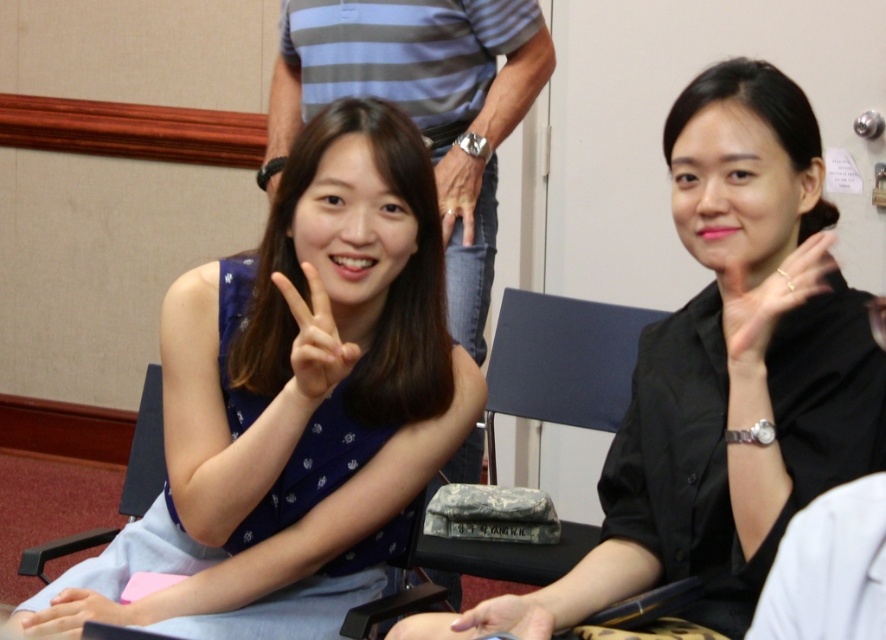
Question: Which object appears farthest from the camera in this image?

Choices:
 (A) camouflage fabric bag at center
 (B) blue fabric chair at left
 (C) blue dotted dress at left

Answer: (A)

Question: Is gold metallic ring at right smaller than matte black hand at center?

Choices:
 (A) no
 (B) yes

Answer: (A)

Question: Is the position of black satin blouse at center more distant than that of matte pink hand at lower left?

Choices:
 (A) no
 (B) yes

Answer: (B)

Question: Which object is closer to the camera taking this photo?

Choices:
 (A) gold metallic ring at right
 (B) black satin blouse at center
 (C) camouflage fabric bag at center
 (D) blue fabric chair at left

Answer: (B)

Question: Can you confirm if camouflage fabric bag at center is positioned above matte black hand at center?

Choices:
 (A) yes
 (B) no

Answer: (A)

Question: Which point is farther to the camera?

Choices:
 (A) gold metallic ring at right
 (B) black satin blouse at center
 (C) matte pink hand at lower left
 (D) blue fabric chair at left

Answer: (D)